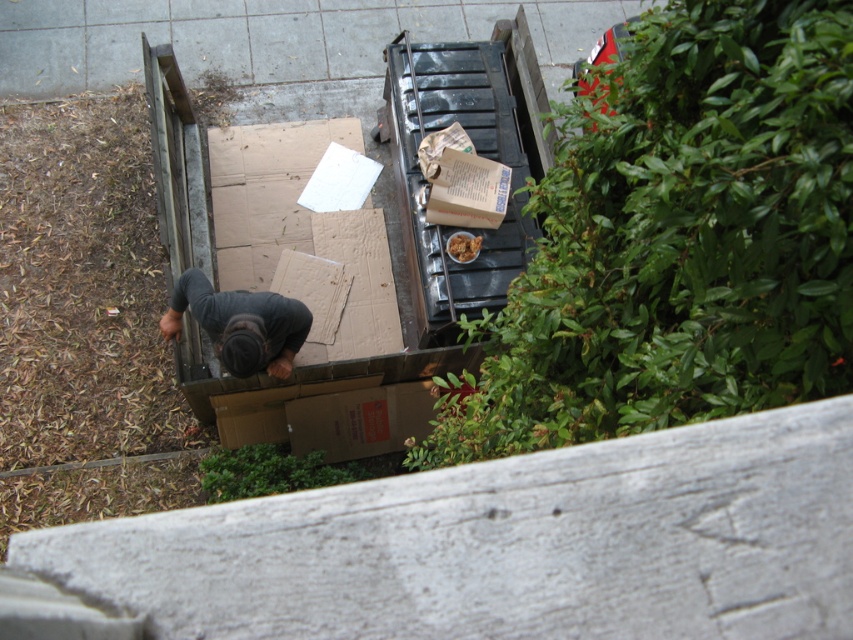
Question: Estimate the real-world distances between objects in this image. Which object is farther from the green leafy bush at lower center?

Choices:
 (A) dark gray fabric at lower center
 (B) green leafy bush at upper right

Answer: (B)

Question: Is green leafy bush at upper right below dark gray fabric at lower center?

Choices:
 (A) no
 (B) yes

Answer: (A)

Question: Does dark gray fabric at lower center appear over green leafy bush at lower center?

Choices:
 (A) no
 (B) yes

Answer: (B)

Question: Which point is farther to the camera?

Choices:
 (A) (596, 422)
 (B) (273, 364)

Answer: (B)

Question: Is green leafy bush at upper right closer to camera compared to green leafy bush at lower center?

Choices:
 (A) yes
 (B) no

Answer: (A)

Question: Among these objects, which one is farthest from the camera?

Choices:
 (A) green leafy bush at upper right
 (B) dark gray fabric at lower center

Answer: (B)